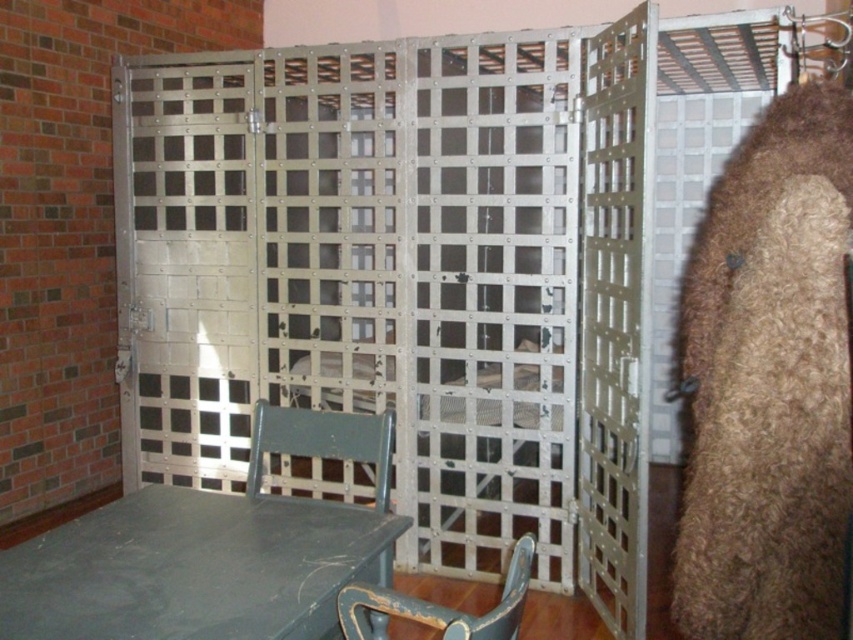
Question: Can you confirm if metallic grid cage at center is wider than matte green chair at center?

Choices:
 (A) yes
 (B) no

Answer: (A)

Question: Is matte green chair at center bigger than chipped paint wood chair at lower center?

Choices:
 (A) yes
 (B) no

Answer: (A)

Question: Which point appears closest to the camera in this image?

Choices:
 (A) (363, 611)
 (B) (772, 340)
 (C) (544, 484)

Answer: (A)

Question: Estimate the real-world distances between objects in this image. Which object is farther from the green painted wood table at lower left?

Choices:
 (A) brown fuzzy coat at right
 (B) metallic grid cage at center
 (C) matte green chair at center

Answer: (B)

Question: Can you confirm if metallic grid cage at center is positioned below chipped paint wood chair at lower center?

Choices:
 (A) no
 (B) yes

Answer: (A)

Question: Which object appears farthest from the camera in this image?

Choices:
 (A) metallic grid cage at center
 (B) green painted wood table at lower left
 (C) brown fuzzy coat at right
 (D) chipped paint wood chair at lower center

Answer: (A)